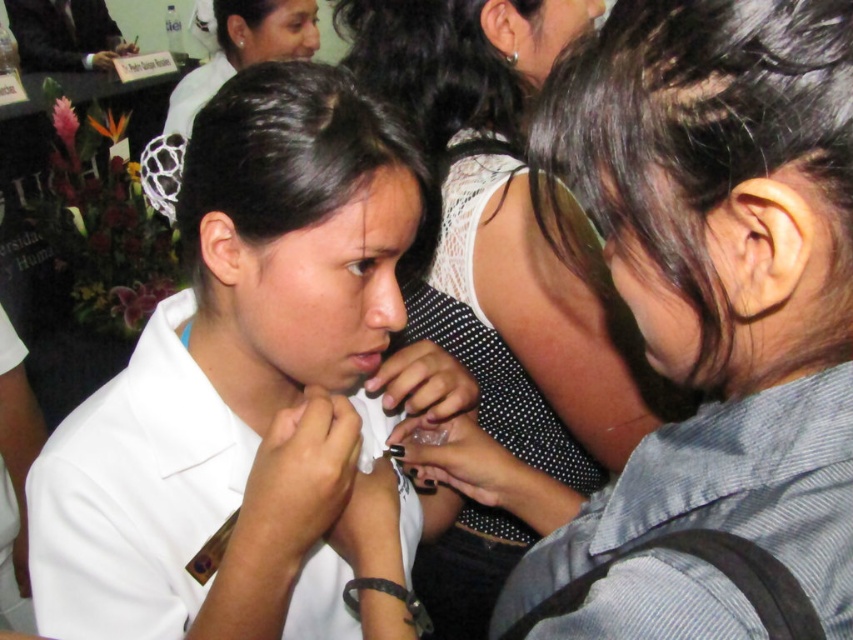
From the picture: You are a photographer standing in front of the scene described. You want to take a closeup shot of the white dotted dress at center. Considering the dress is 20.04 inches from you, can you focus on it without adjusting your camera distance?

The white dotted dress at center is 20.04 inches from the viewer, so yes, you can focus on it without moving closer or farther since it is within the typical focusing range of most cameras.

You are a medical student observing a procedure in the image. You notice two white uniforms. Which one is closer to you, the white uniform shirt at center or the white uniform at upper center?

The white uniform shirt at center is closer to the viewer than the white uniform at upper center.